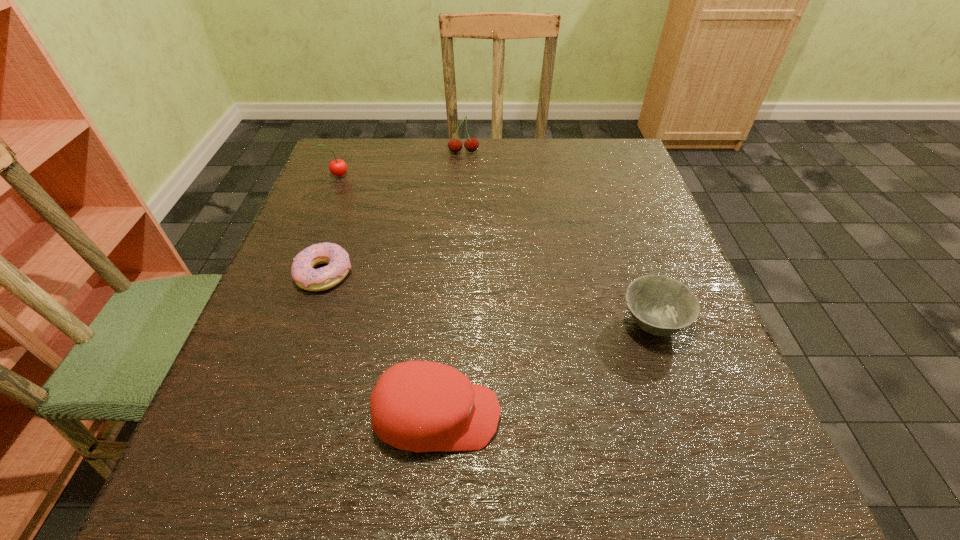
This screenshot has height=540, width=960. I want to click on free space located 0.270m on the front of the left cherry, so click(x=306, y=254).

The width and height of the screenshot is (960, 540). Identify the location of vacant space located 0.170m on the front-facing side of the nearest object. (613, 416).

I want to click on vacant space located 0.160m on the back of the second shortest object, so click(x=625, y=241).

Image resolution: width=960 pixels, height=540 pixels. In order to click on vacant region located on the back of the shortest object in this screenshot , I will do `click(350, 197)`.

Where is `object positioned at the near edge`? Image resolution: width=960 pixels, height=540 pixels. object positioned at the near edge is located at coordinates (421, 406).

The height and width of the screenshot is (540, 960). I want to click on cherry present at the left edge, so click(x=338, y=167).

Locate an element on the screen. This screenshot has height=540, width=960. doughnut present at the left edge is located at coordinates (303, 273).

Where is `object that is at the right edge`? The image size is (960, 540). object that is at the right edge is located at coordinates (661, 306).

I want to click on object that is at the far left corner, so click(x=338, y=167).

Locate an element on the screen. free location at the far edge of the desktop is located at coordinates (511, 167).